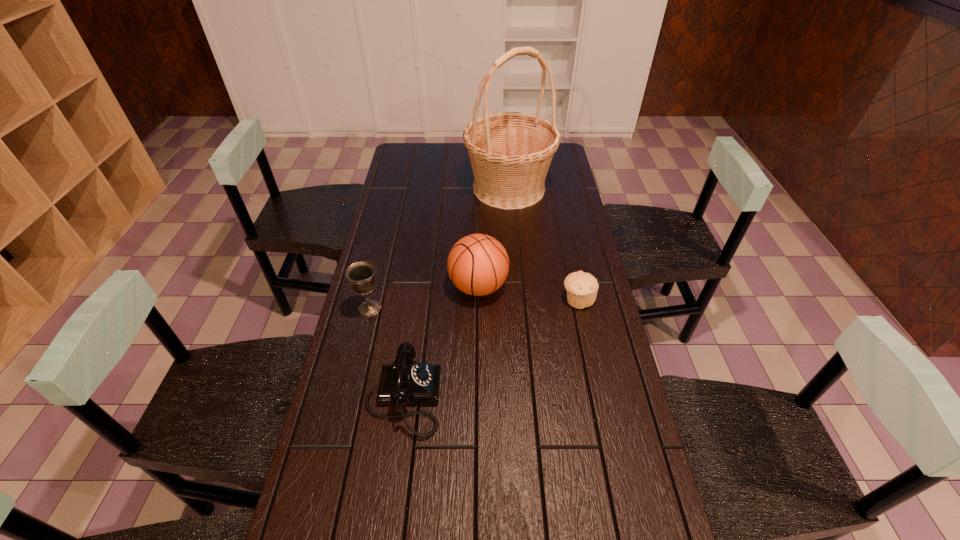
Locate an element on the screen. free space at the left edge of the desktop is located at coordinates (400, 184).

In the image, there is a desktop. At what (x,y) coordinates should I click in order to perform the action: click on vacant space at the right edge. Please return your answer as a coordinate pair (x, y). The width and height of the screenshot is (960, 540). Looking at the image, I should click on (612, 342).

The height and width of the screenshot is (540, 960). Find the location of `free space at the far left corner of the desktop`. free space at the far left corner of the desktop is located at coordinates (406, 146).

Find the location of a particular element. The width and height of the screenshot is (960, 540). vacant area that lies between the farthest object and the fourth object from right to left is located at coordinates (456, 293).

The width and height of the screenshot is (960, 540). Identify the location of vacant region between the chalice and the farthest object. (440, 248).

You are a GUI agent. You are given a task and a screenshot of the screen. Output one action in this format:
    pyautogui.click(x=<x>, y=<y>)
    Task: Click on the vacant space in between the telephone and the tallest object
    The image size is (960, 540).
    Given the screenshot: What is the action you would take?
    pyautogui.click(x=456, y=293)

The image size is (960, 540). In order to click on empty space between the basket and the fourth object from right to left in this screenshot , I will do `click(456, 293)`.

Where is `vacant space that is in between the chalice and the farthest object`? The image size is (960, 540). vacant space that is in between the chalice and the farthest object is located at coordinates (440, 248).

At what (x,y) coordinates should I click in order to perform the action: click on free space between the nearest object and the tallest object. Please return your answer as a coordinate pair (x, y). This screenshot has width=960, height=540. Looking at the image, I should click on (456, 293).

Image resolution: width=960 pixels, height=540 pixels. I want to click on unoccupied position between the fourth object from right to left and the muffin, so click(491, 348).